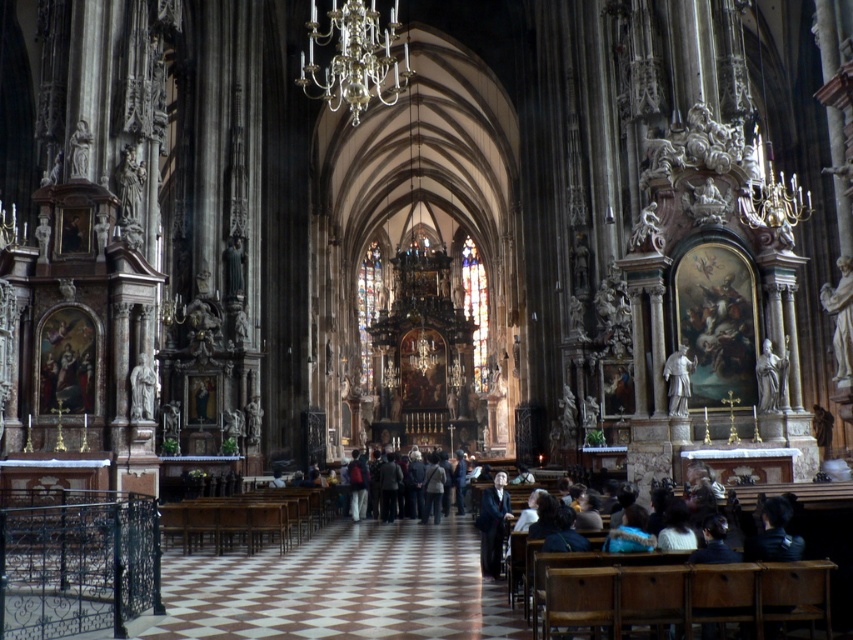
You are standing at the entrance of the cathedral and want to visit both the white marble statue at right and the gray stone statue at center. If you first go to the closer one, which statue should you visit first?

The gray stone statue at center is closer to the entrance than the white marble statue at right, so you should visit the gray stone statue at center first.

From the picture: You are a photographer planning to take a group photo of the people in the dark suit at center and the silver statue at right. Since you want to ensure both subjects are in focus, you need to know which one is taller. Can you tell me which is taller?

The dark suit at center is much taller than the silver statue at right, so you should adjust your camera settings to focus on the dark suit at center first.

You are standing at the entrance of the cathedral and want to take a photo of both the white marble statue at right and the gray stone statue at center. Which statue will appear larger in your photo?

The white marble statue at right will appear larger in your photo because it is much taller than the gray stone statue at center.